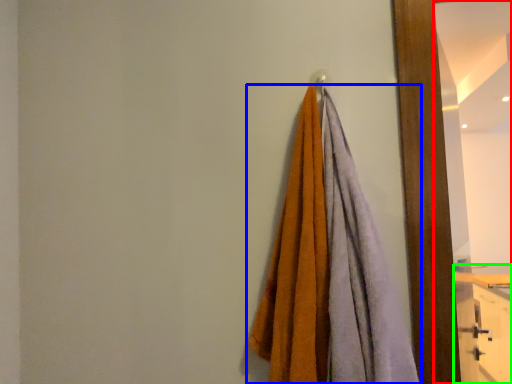
Question: Estimate the real-world distances between objects in this image. Which object is farther from mirror (highlighted by a red box), towel (highlighted by a blue box) or dresser (highlighted by a green box)?

Choices:
 (A) towel
 (B) dresser

Answer: (A)